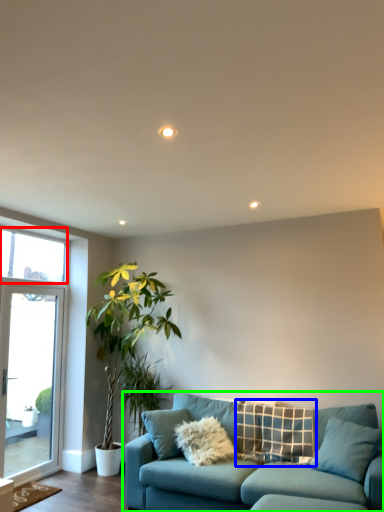
Question: Which object is the closest to the window screen (highlighted by a red box)? Choose among these: pillow (highlighted by a blue box) or studio couch (highlighted by a green box).

Choices:
 (A) pillow
 (B) studio couch

Answer: (B)